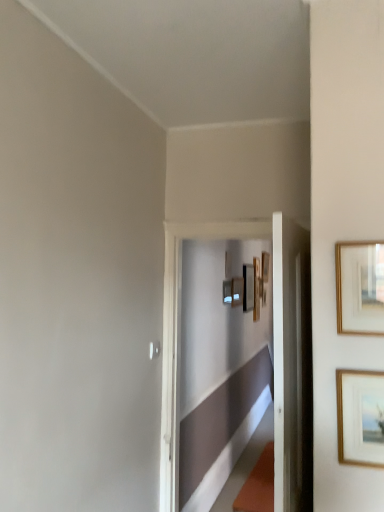
Question: Should I look upward or downward to see matte black picture frame at center, which is counted as the 4th picture frame, starting from the back?

Choices:
 (A) up
 (B) down

Answer: (B)

Question: Is matte black picture frame at center, which is counted as the 4th picture frame, starting from the back, bigger than gold-framed picture at upper right, positioned as the 5th picture frame in back-to-front order?

Choices:
 (A) yes
 (B) no

Answer: (A)

Question: From the image's perspective, is matte black picture frame at center, which is the third picture frame from front to back, located beneath gold-framed picture at upper right, marked as the 2th picture frame in a front-to-back arrangement?

Choices:
 (A) no
 (B) yes

Answer: (B)

Question: From the image's perspective, is matte black picture frame at center, which is counted as the 4th picture frame, starting from the back, located above gold-framed picture at upper right, marked as the 2th picture frame in a front-to-back arrangement?

Choices:
 (A) no
 (B) yes

Answer: (A)

Question: Considering the relative sizes of matte black picture frame at center, which is the third picture frame from front to back, and gold-framed picture at upper right, positioned as the 5th picture frame in back-to-front order, in the image provided, is matte black picture frame at center, which is the third picture frame from front to back, thinner than gold-framed picture at upper right, positioned as the 5th picture frame in back-to-front order,?

Choices:
 (A) no
 (B) yes

Answer: (A)

Question: Is matte black picture frame at center, which is counted as the 4th picture frame, starting from the back, to the left of gold-framed picture at upper right, positioned as the 5th picture frame in back-to-front order, from the viewer's perspective?

Choices:
 (A) no
 (B) yes

Answer: (B)

Question: Considering the relative positions of matte black picture frame at center, which is the third picture frame from front to back, and gold-framed picture at upper right, marked as the 2th picture frame in a front-to-back arrangement, in the image provided, is matte black picture frame at center, which is the third picture frame from front to back, behind gold-framed picture at upper right, marked as the 2th picture frame in a front-to-back arrangement,?

Choices:
 (A) yes
 (B) no

Answer: (A)

Question: Is wooden picture frame at center, the sixth picture frame when ordered from front to back, far away from wooden picture frame at center, the fourth picture frame when ordered from front to back?

Choices:
 (A) yes
 (B) no

Answer: (B)

Question: Is wooden picture frame at center, the sixth picture frame when ordered from front to back, thinner than wooden picture frame at center, which appears as the third picture frame when viewed from the back?

Choices:
 (A) yes
 (B) no

Answer: (B)

Question: From a real-world perspective, does wooden picture frame at center, the sixth picture frame when ordered from front to back, stand above wooden picture frame at center, which appears as the third picture frame when viewed from the back?

Choices:
 (A) yes
 (B) no

Answer: (B)

Question: From the image's perspective, would you say wooden picture frame at center, the sixth picture frame when ordered from front to back, is shown under wooden picture frame at center, the fourth picture frame when ordered from front to back?

Choices:
 (A) no
 (B) yes

Answer: (B)

Question: Considering the relative sizes of wooden picture frame at center, which ranks as the 1th picture frame in back-to-front order, and wooden picture frame at center, which appears as the third picture frame when viewed from the back, in the image provided, is wooden picture frame at center, which ranks as the 1th picture frame in back-to-front order, taller than wooden picture frame at center, which appears as the third picture frame when viewed from the back,?

Choices:
 (A) yes
 (B) no

Answer: (A)

Question: Is wooden picture frame at center, the sixth picture frame when ordered from front to back, facing towards wooden picture frame at center, which appears as the third picture frame when viewed from the back?

Choices:
 (A) no
 (B) yes

Answer: (A)

Question: Is matte black picture frame at center, which is the third picture frame from front to back, next to wooden picture frame at center, the fourth picture frame when ordered from front to back, and touching it?

Choices:
 (A) yes
 (B) no

Answer: (A)